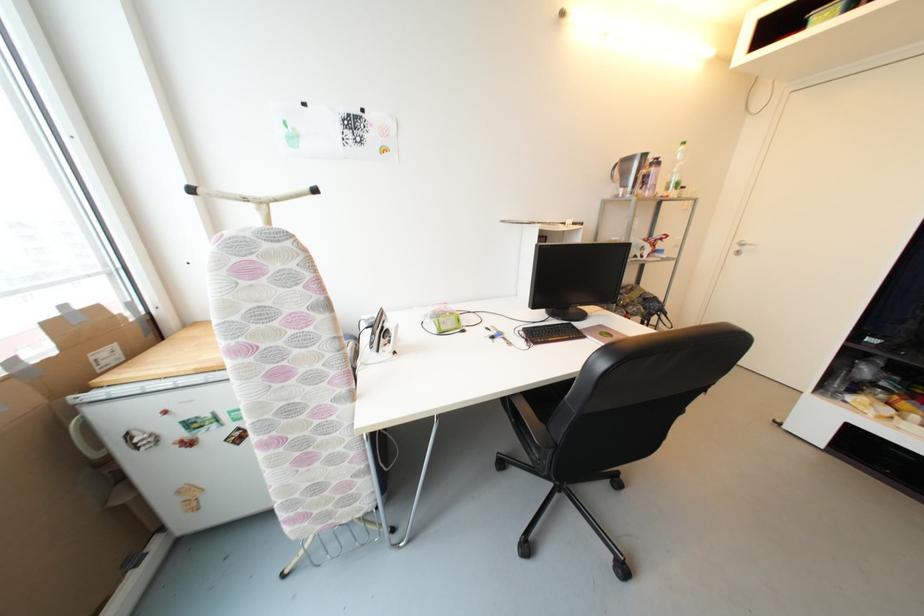
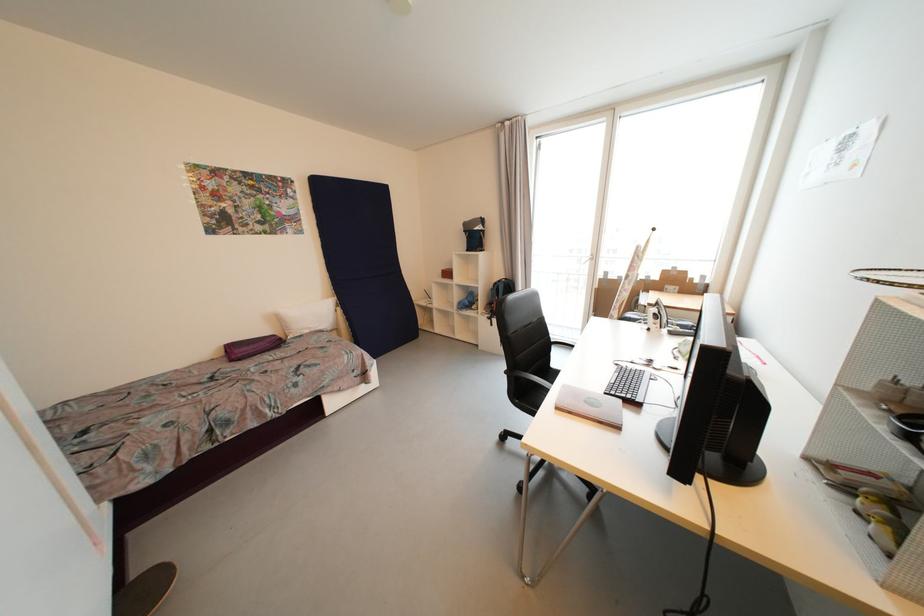
Question: I am providing you with two images of the same scene from different viewpoints. Please identify which objects are invisible in image2.

Choices:
 (A) chrome grab bar
 (B) black chair sitting surface
 (C) white electric iron
 (D) chair sitting surface

Answer: (B)